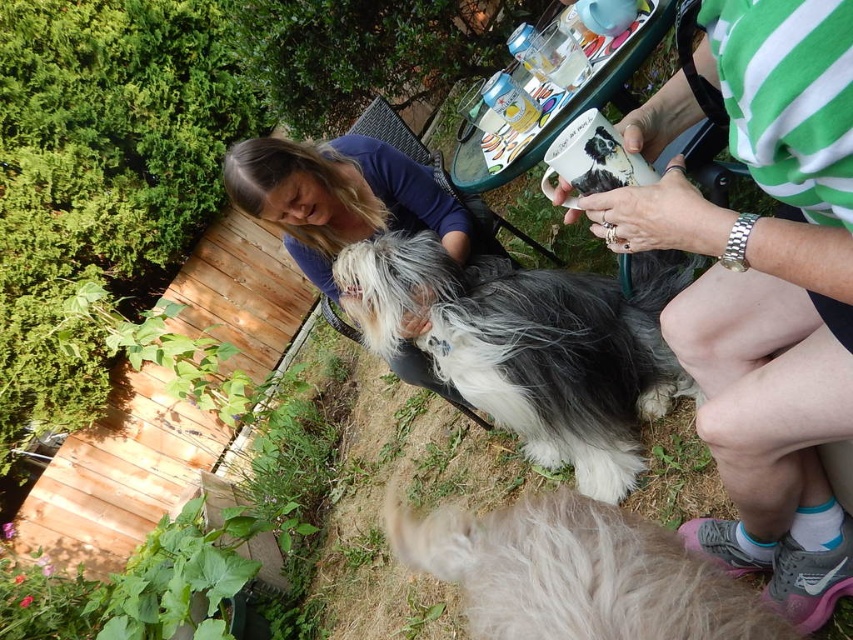
Can you confirm if fluffy white fur at lower center is wider than blue cotton shirt at center?

No, fluffy white fur at lower center is not wider than blue cotton shirt at center.

The image size is (853, 640). What do you see at coordinates (576, 572) in the screenshot?
I see `fluffy white fur at lower center` at bounding box center [576, 572].

The height and width of the screenshot is (640, 853). What do you see at coordinates (576, 572) in the screenshot?
I see `fluffy white fur at lower center` at bounding box center [576, 572].

Identify the location of fluffy white fur at lower center. (576, 572).

Which of these two, white ceramic mug at upper center or fluffy gray-white fur at center, stands taller?

Standing taller between the two is white ceramic mug at upper center.

Which is behind, point (757, 454) or point (633, 456)?

The point (633, 456) is more distant.

This screenshot has height=640, width=853. What do you see at coordinates (766, 292) in the screenshot?
I see `white ceramic mug at upper center` at bounding box center [766, 292].

The height and width of the screenshot is (640, 853). I want to click on white ceramic mug at upper center, so click(766, 292).

Is fluffy gray-white fur at center shorter than blue cotton shirt at center?

No.

Who is shorter, fluffy gray-white fur at center or blue cotton shirt at center?

Standing shorter between the two is blue cotton shirt at center.

Identify the location of fluffy gray-white fur at center. Image resolution: width=853 pixels, height=640 pixels. (531, 346).

Find the location of a particular element. Image resolution: width=853 pixels, height=640 pixels. fluffy gray-white fur at center is located at coordinates (531, 346).